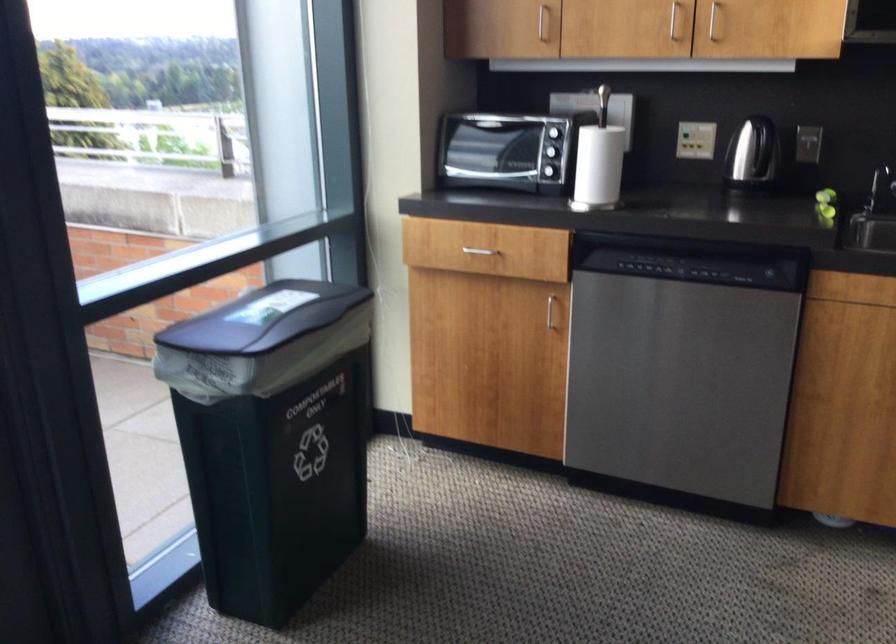
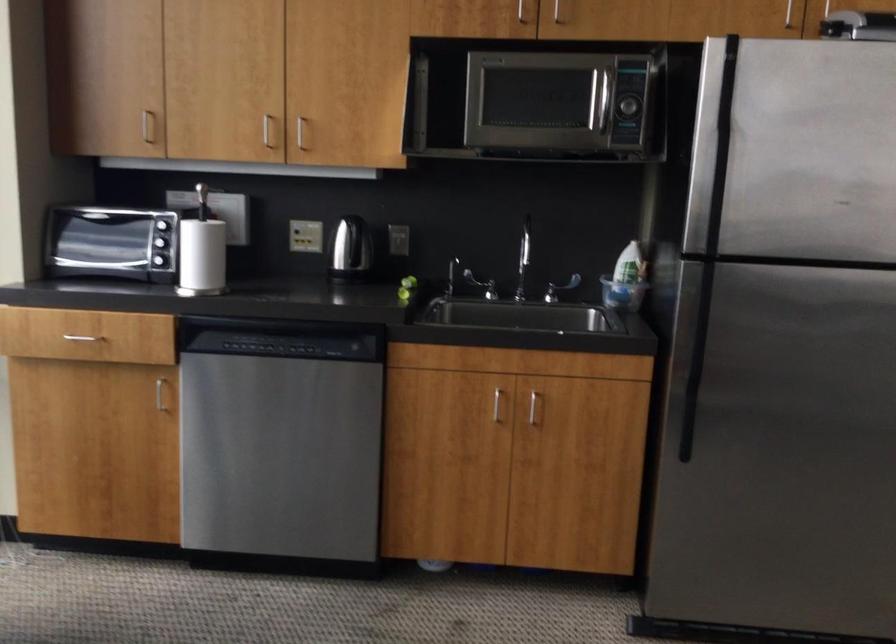
Locate, in the second image, the point that corresponds to (666,263) in the first image.

(277, 346)